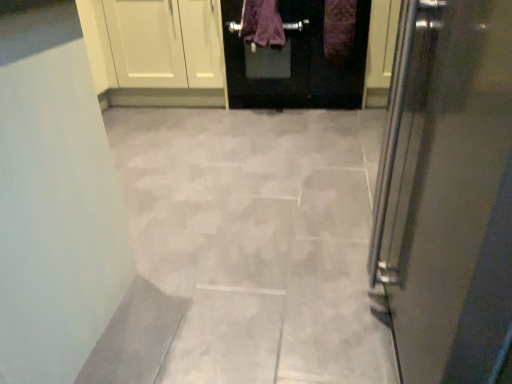
Question: Should I look upward or downward to see matte black door at upper center?

Choices:
 (A) up
 (B) down

Answer: (A)

Question: Does matte black door at upper center have a greater width compared to purple fabric at center, which is the first blanket in left-to-right order?

Choices:
 (A) no
 (B) yes

Answer: (B)

Question: Is purple fabric at center, which is the first blanket in left-to-right order, at the back of matte black door at upper center?

Choices:
 (A) no
 (B) yes

Answer: (A)

Question: From a real-world perspective, is matte black door at upper center beneath purple fabric at center, which is the first blanket in left-to-right order?

Choices:
 (A) no
 (B) yes

Answer: (B)

Question: Can you confirm if matte black door at upper center is positioned to the left of purple fabric at center, which is the first blanket in left-to-right order?

Choices:
 (A) yes
 (B) no

Answer: (B)

Question: Is purple fabric at center, which appears as the second blanket when viewed from the right, located within matte black door at upper center?

Choices:
 (A) no
 (B) yes

Answer: (B)

Question: Is matte black door at upper center facing towards purple fabric at center, which is the first blanket in left-to-right order?

Choices:
 (A) yes
 (B) no

Answer: (A)

Question: Is purple fabric at center, which appears as the second blanket when viewed from the right, to the left of gray stone tile at center from the viewer's perspective?

Choices:
 (A) no
 (B) yes

Answer: (A)

Question: Is purple fabric at center, which appears as the second blanket when viewed from the right, at the right side of gray stone tile at center?

Choices:
 (A) yes
 (B) no

Answer: (A)

Question: Is purple fabric at center, which is the first blanket in left-to-right order, positioned beyond the bounds of gray stone tile at center?

Choices:
 (A) no
 (B) yes

Answer: (B)

Question: From a real-world perspective, is purple fabric at center, which is the first blanket in left-to-right order, on gray stone tile at center?

Choices:
 (A) yes
 (B) no

Answer: (A)

Question: From the image's perspective, would you say purple fabric at center, which is the first blanket in left-to-right order, is shown under gray stone tile at center?

Choices:
 (A) yes
 (B) no

Answer: (B)

Question: Does purple fabric at center, which appears as the second blanket when viewed from the right, have a greater width compared to gray stone tile at center?

Choices:
 (A) no
 (B) yes

Answer: (A)

Question: Can you confirm if purple fuzzy blanket at upper center, the second blanket from the left, is positioned to the left of purple fabric at center, which is the first blanket in left-to-right order?

Choices:
 (A) yes
 (B) no

Answer: (B)